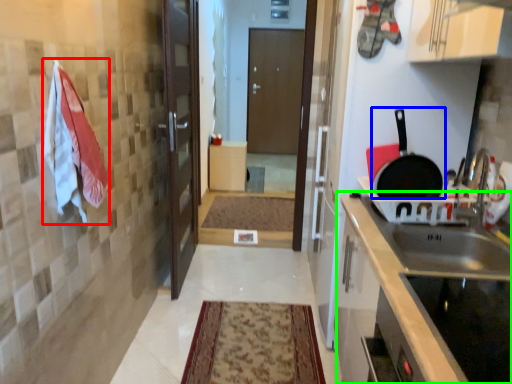
Question: Which object is positioned closest to laundry (highlighted by a red box)? Select from frying pan (highlighted by a blue box) and countertop (highlighted by a green box).

Choices:
 (A) frying pan
 (B) countertop

Answer: (B)